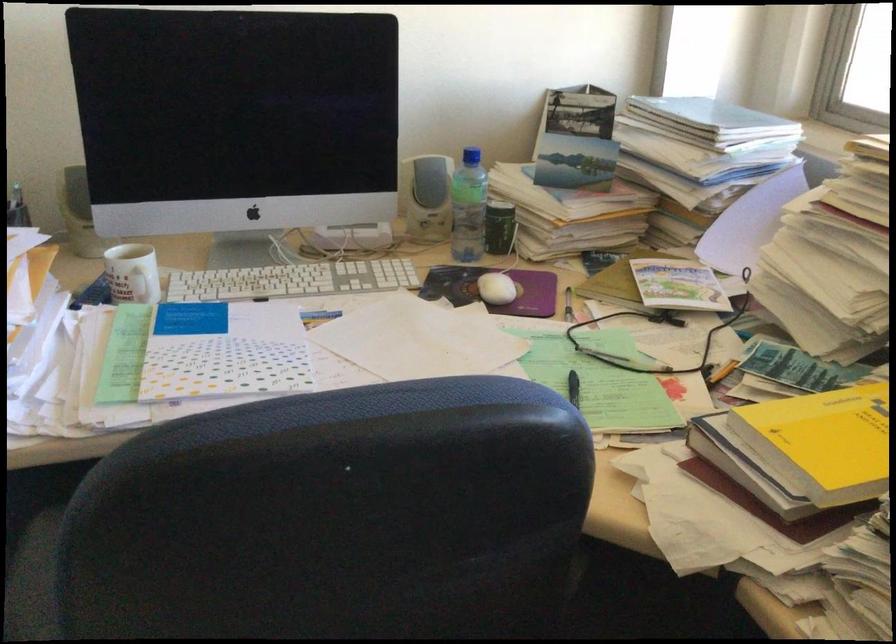
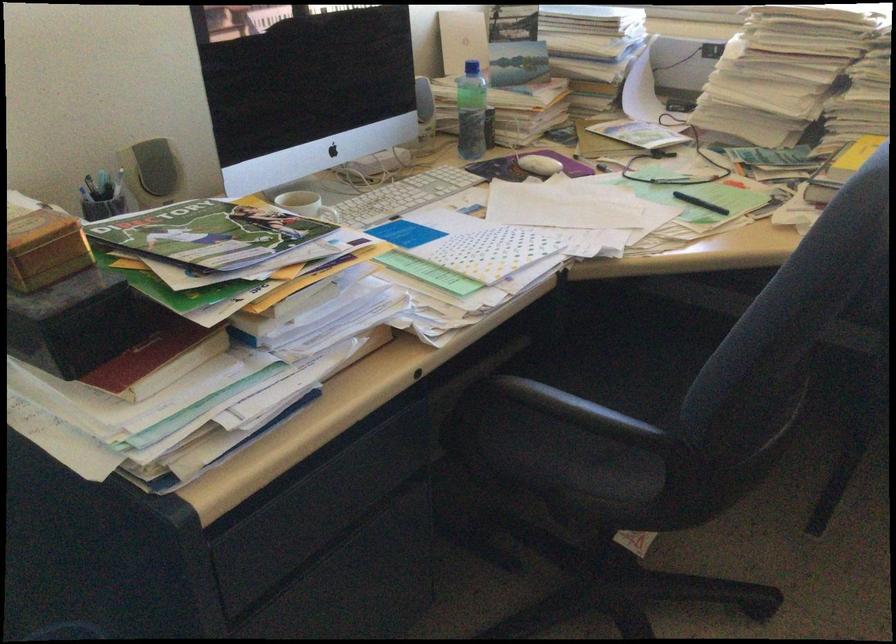
In the second image, find the point that corresponds to (x=476, y=289) in the first image.

(538, 165)